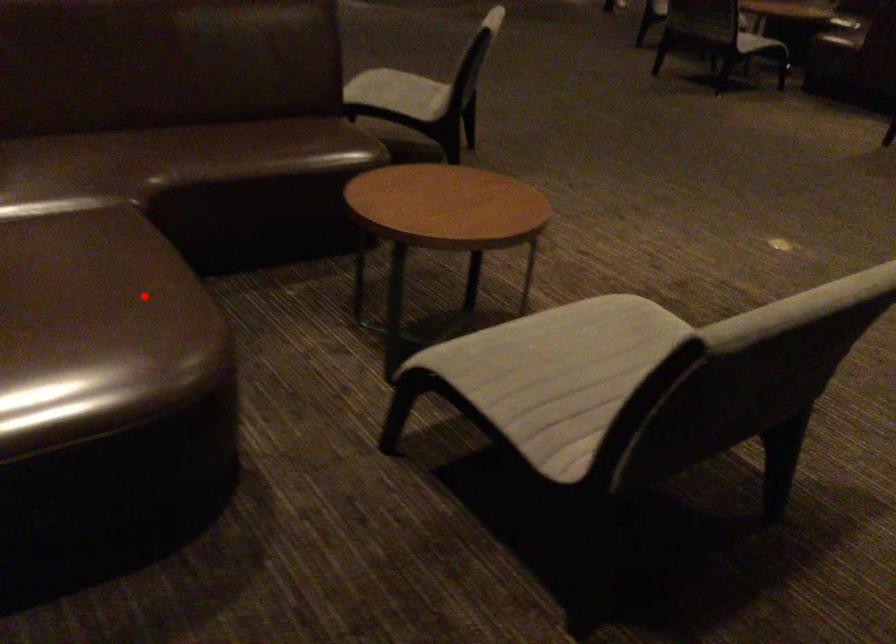
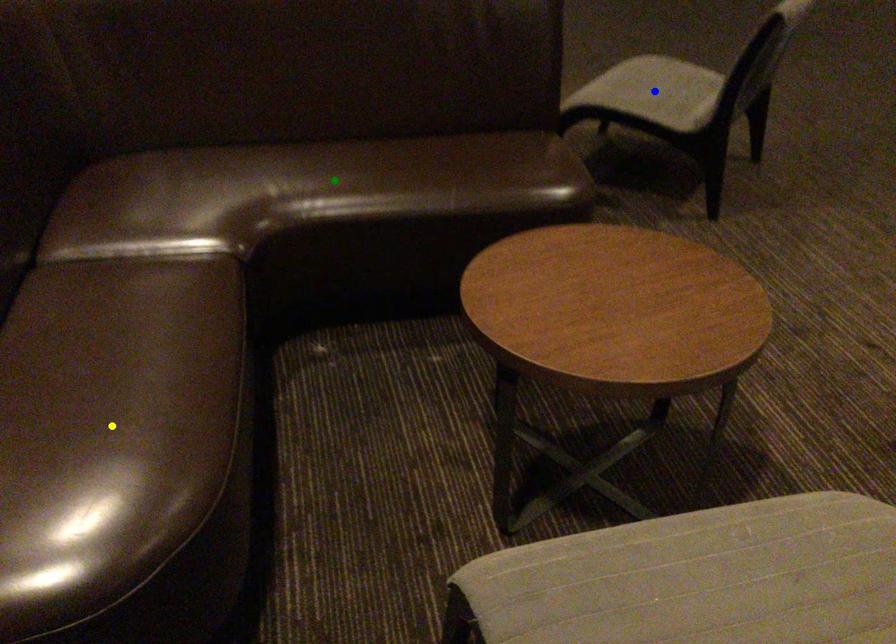
Question: I am providing you with two images of the same scene from different viewpoints. A red point is marked on the first image. You are given multiple points on the second image. In image 2, which mark is for the same physical point as the one in image 1?

Choices:
 (A) yellow point
 (B) blue point
 (C) green point

Answer: (A)